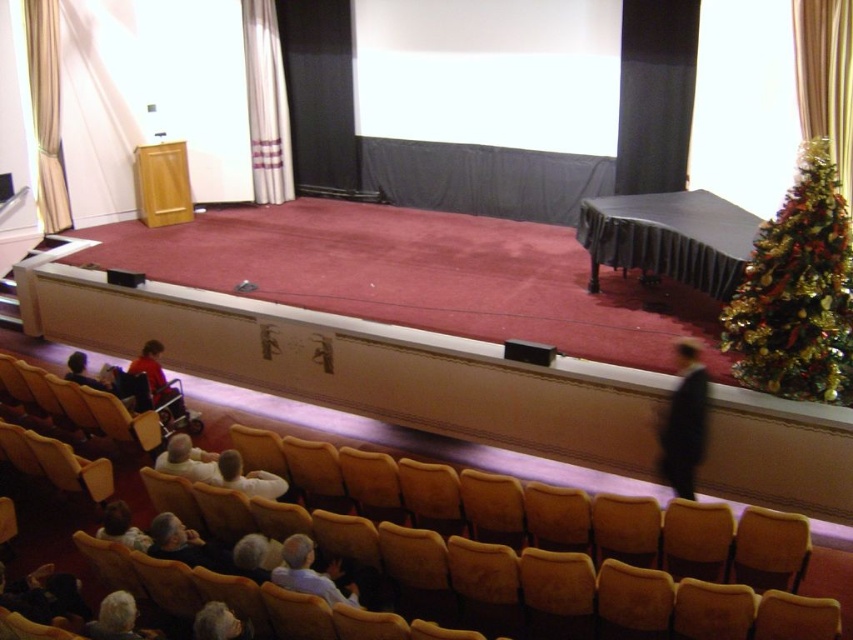
Question: Which of these objects is positioned farthest from the light brown leather jacket at lower left?

Choices:
 (A) black suit at center
 (B) green shiny christmas tree at right
 (C) gold textured curtain at upper right

Answer: (C)

Question: Can you confirm if white fabric curtain at upper center is positioned above gray hair at lower left?

Choices:
 (A) yes
 (B) no

Answer: (A)

Question: Does green shiny christmas tree at right have a smaller size compared to gold textured curtain at left?

Choices:
 (A) yes
 (B) no

Answer: (B)

Question: Which of the following is the farthest from the observer?

Choices:
 (A) gray hair at lower left
 (B) light brown leather jacket at lower left
 (C) matte red shirt at center

Answer: (C)

Question: From the image, what is the correct spatial relationship of gold textured curtain at upper right in relation to light brown leather jacket at lower left?

Choices:
 (A) above
 (B) below

Answer: (A)

Question: Which of the following is the farthest from the observer?

Choices:
 (A) (134, 609)
 (B) (138, 545)

Answer: (B)